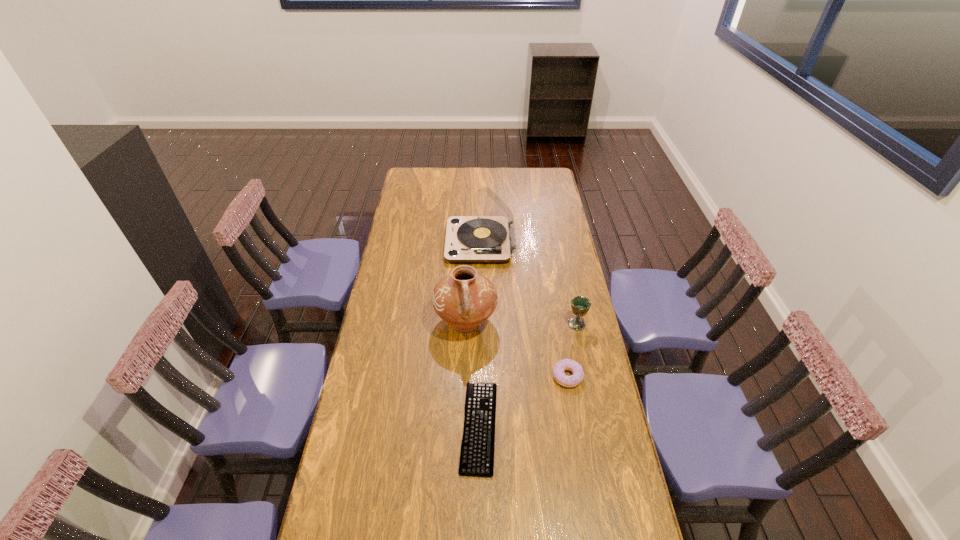
Identify the location of vacant area in the image that satisfies the following two spatial constraints: 1. on the back side of the chalice; 2. on the left side of the second shortest object. (559, 324).

This screenshot has height=540, width=960. In order to click on vacant region that satisfies the following two spatial constraints: 1. with the tonearm facing the front of the farthest object; 2. on the left side of the doughnut in this screenshot , I will do `click(481, 376)`.

In order to click on free location that satisfies the following two spatial constraints: 1. on the side of the pottery with the handle; 2. on the left side of the third tallest object in this screenshot , I will do `click(466, 324)`.

This screenshot has height=540, width=960. Find the location of `free space that satisfies the following two spatial constraints: 1. on the side of the second shortest object with the handle; 2. on the right side of the pottery`. free space that satisfies the following two spatial constraints: 1. on the side of the second shortest object with the handle; 2. on the right side of the pottery is located at coordinates (464, 376).

Locate an element on the screen. Image resolution: width=960 pixels, height=540 pixels. free space that satisfies the following two spatial constraints: 1. with the tonearm facing the front of the farthest object; 2. on the back side of the doughnut is located at coordinates (481, 376).

Where is `free space that satisfies the following two spatial constraints: 1. on the side of the chalice with the handle; 2. on the left side of the pottery`? free space that satisfies the following two spatial constraints: 1. on the side of the chalice with the handle; 2. on the left side of the pottery is located at coordinates (466, 324).